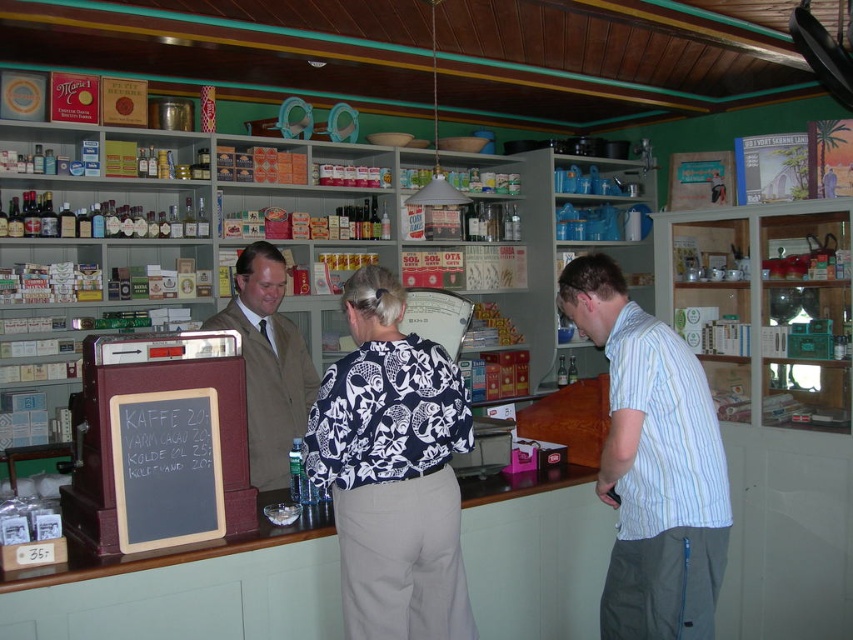
Question: Considering the relative positions of floral print blouse at center and black chalkboard at center in the image provided, where is floral print blouse at center located with respect to black chalkboard at center?

Choices:
 (A) below
 (B) above

Answer: (B)

Question: Which point is farther from the camera taking this photo?

Choices:
 (A) (701, 435)
 (B) (367, 266)
 (C) (212, 518)

Answer: (B)

Question: Which point is farther to the camera?

Choices:
 (A) black chalkboard at center
 (B) striped cotton shirt at center
 (C) floral print blouse at center
 (D) brown leather jacket at center

Answer: (D)

Question: Among these points, which one is farthest from the camera?

Choices:
 (A) (160, 401)
 (B) (253, 388)
 (C) (634, 532)
 (D) (665, 369)

Answer: (B)

Question: Is floral print blouse at center below black chalkboard at center?

Choices:
 (A) no
 (B) yes

Answer: (A)

Question: Can you confirm if white floral blouse at center is bigger than black chalkboard at center?

Choices:
 (A) yes
 (B) no

Answer: (A)